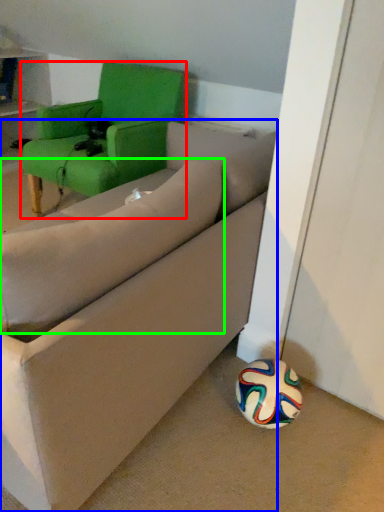
Question: Which object is the farthest from chair (highlighted by a red box)? Choose among these: studio couch (highlighted by a blue box) or pillow (highlighted by a green box).

Choices:
 (A) studio couch
 (B) pillow

Answer: (B)